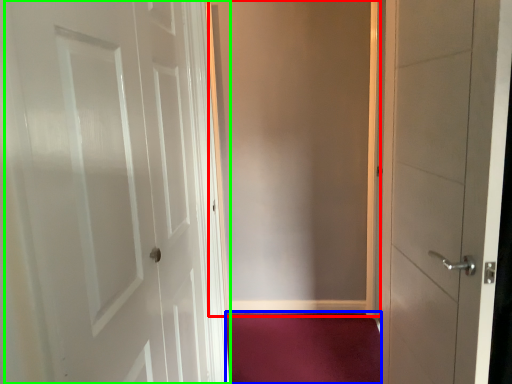
Question: Estimate the real-world distances between objects in this image. Which object is farther from screen door (highlighted by a red box), plain (highlighted by a blue box) or door (highlighted by a green box)?

Choices:
 (A) plain
 (B) door

Answer: (B)